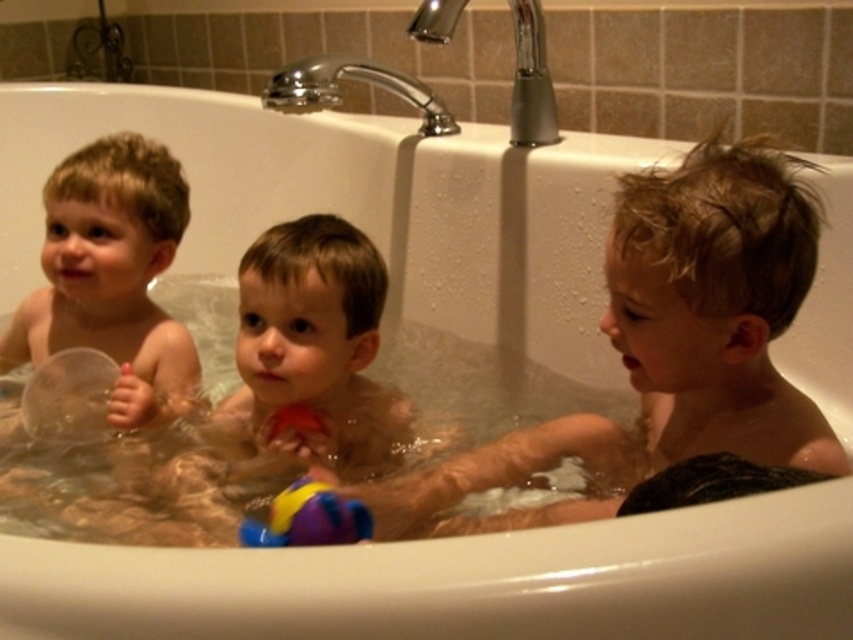
Based on the photo, you are a parent trying to retrieve the rubberized multicolored ball at lower center from the bathtub. The transparent plastic cup at left is blocking your path. Can you reach the ball without moving the cup?

The transparent plastic cup at left is further to the viewer than the rubberized multicolored ball at lower center, so the cup is closer to you. This means the cup is in front of the ball, blocking your path. To reach the ball without moving the cup, you would need to maneuver around it or lift it, but since the cup is closer, you can carefully move your hand around the cup to access the ball.

In the bathroom scene with a white bathtub where three children are playing, you need to determine if the blonde hair boy at center can reach the smooth plastic ball at center without standing up. Based on their sizes, can he do it?

The blonde hair boy at center is much taller as smooth plastic ball at center, so he can easily reach the smooth plastic ball at center without needing to stand up.

You are taking a photo of the children in the bathtub. You notice two points in the image at coordinates point [726,221] and point [285,493]. Which point will appear closer to the camera in the photo?

Point [285,493] will appear closer to the camera because it is closer to the viewer than point [726,221], which is further away.